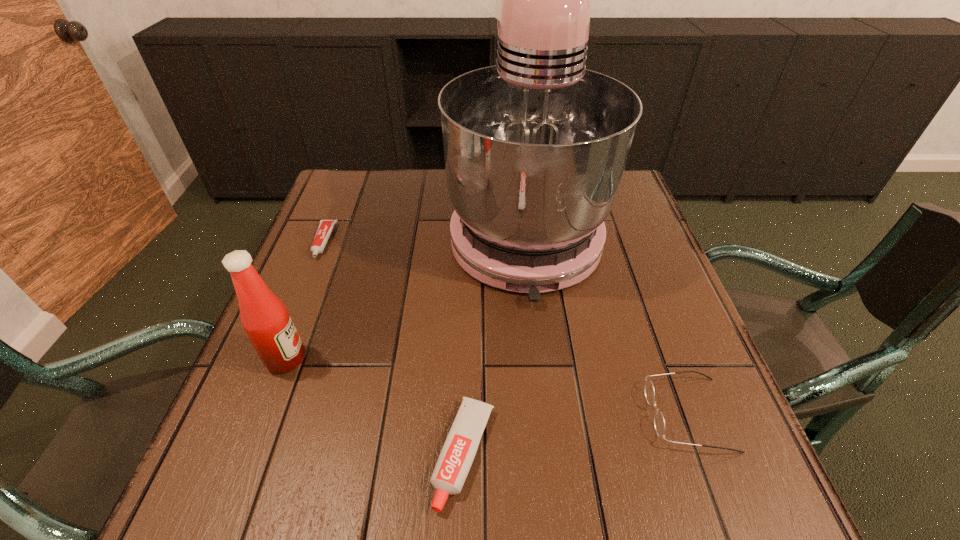
The image size is (960, 540). In order to click on vacant space that satisfies the following two spatial constraints: 1. at the nozzle of the right toothpaste; 2. on the right side of the farther toothpaste in this screenshot , I will do pos(238,454).

The height and width of the screenshot is (540, 960). In order to click on free spot that satisfies the following two spatial constraints: 1. on the front-facing side of the fourth shortest object; 2. on the right side of the right toothpaste in this screenshot , I will do `click(250, 454)`.

This screenshot has height=540, width=960. Identify the location of vacant space that satisfies the following two spatial constraints: 1. on the front-facing side of the third nearest object; 2. on the right side of the taller toothpaste. (250, 454).

The image size is (960, 540). Identify the location of vacant position in the image that satisfies the following two spatial constraints: 1. at the nozzle of the left toothpaste; 2. on the left side of the nearer toothpaste. [x=238, y=454].